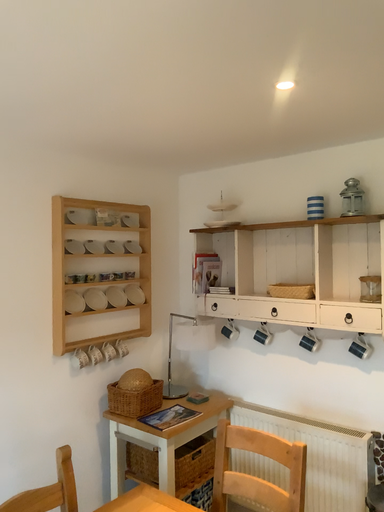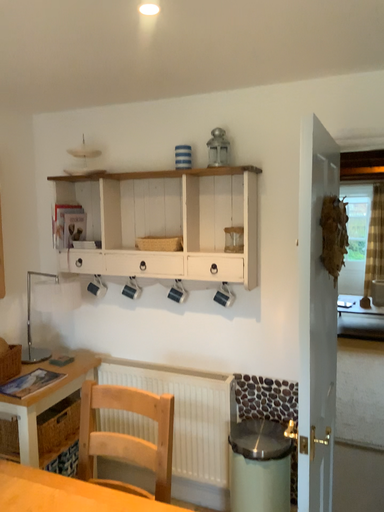
Question: Which way did the camera rotate in the video?

Choices:
 (A) rotated right
 (B) rotated left

Answer: (A)